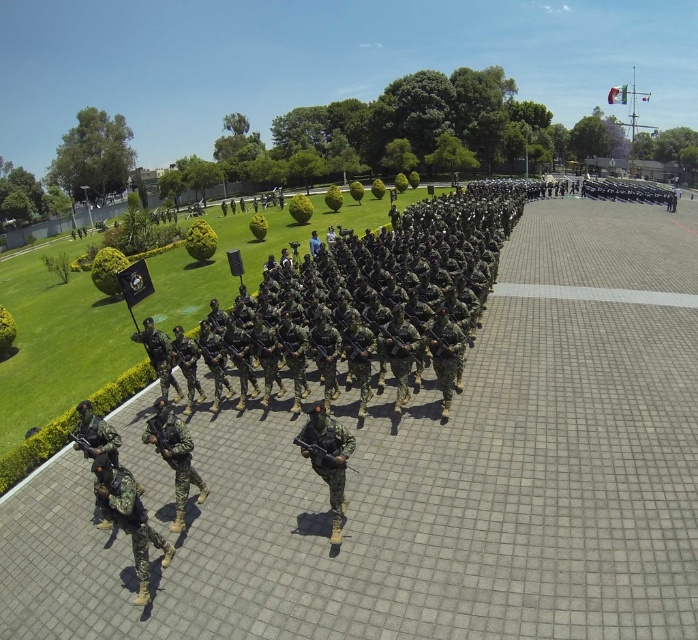
You are a photographer positioned at the front of the parade. You want to capture a photo that includes both the camouflage fabric uniform at lower left and the camouflage fabric uniform at center. Which uniform will appear smaller in the photo?

The camouflage fabric uniform at lower left will appear smaller in the photo because it has a lesser height compared to the camouflage fabric uniform at center.